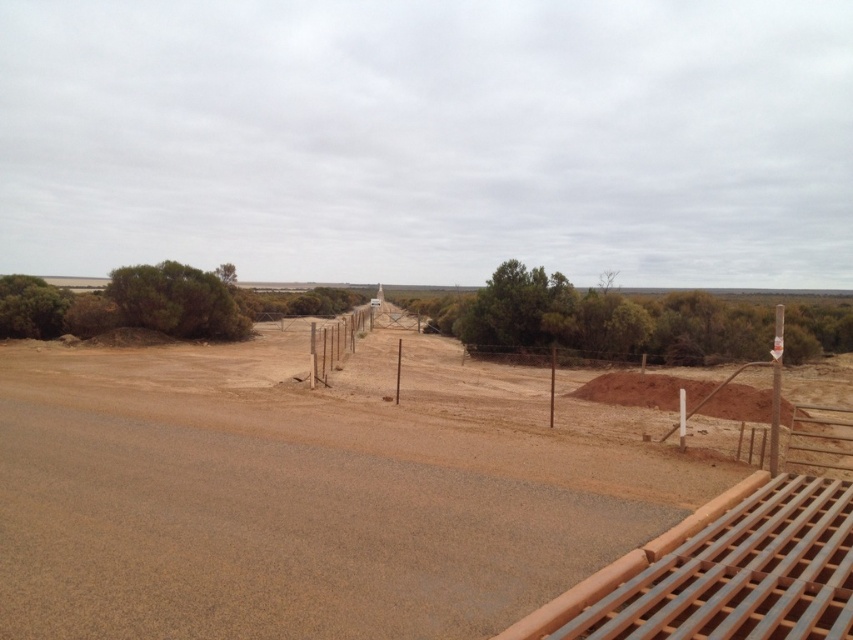
You are driving a truck that is 5 meters long and want to park it between the brown sandy dirt field at center and the brown wire fence at center. Can you fit your truck completely between them without touching either?

The distance between the brown sandy dirt field at center and the brown wire fence at center is 4.88 meters. Since your truck is 5 meters long, it cannot fit completely between them without overlapping or touching either object.